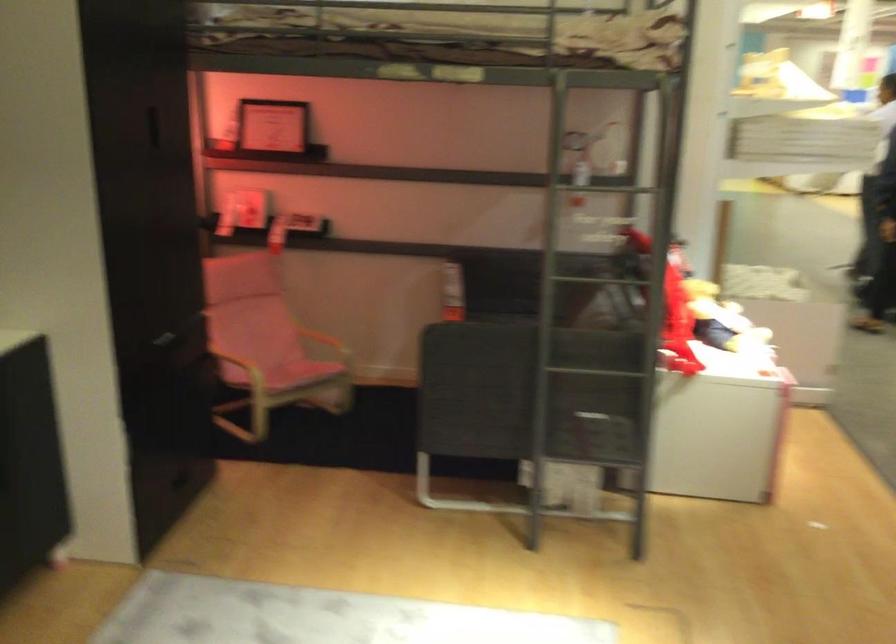
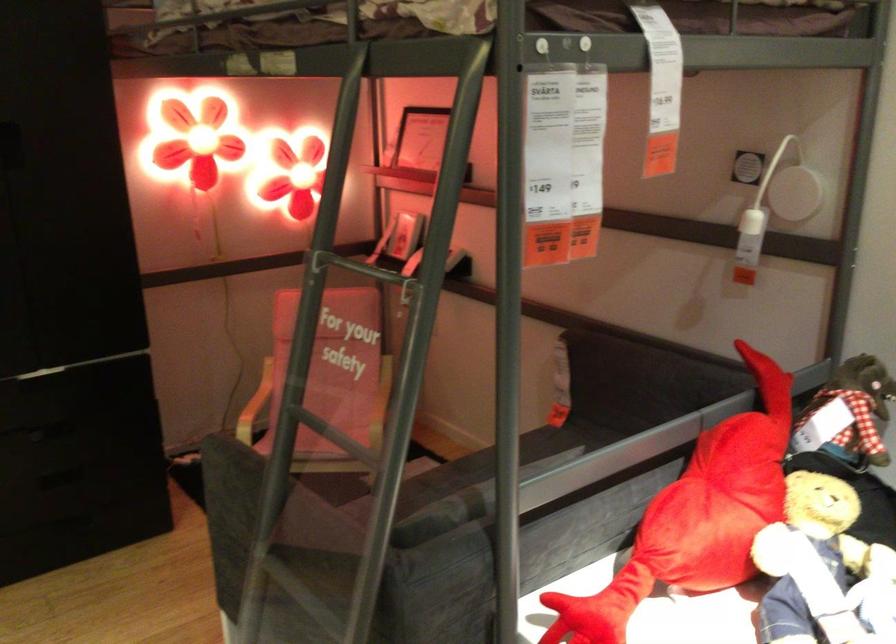
Locate, in the second image, the point that corresponds to point (492, 313) in the first image.

(567, 437)